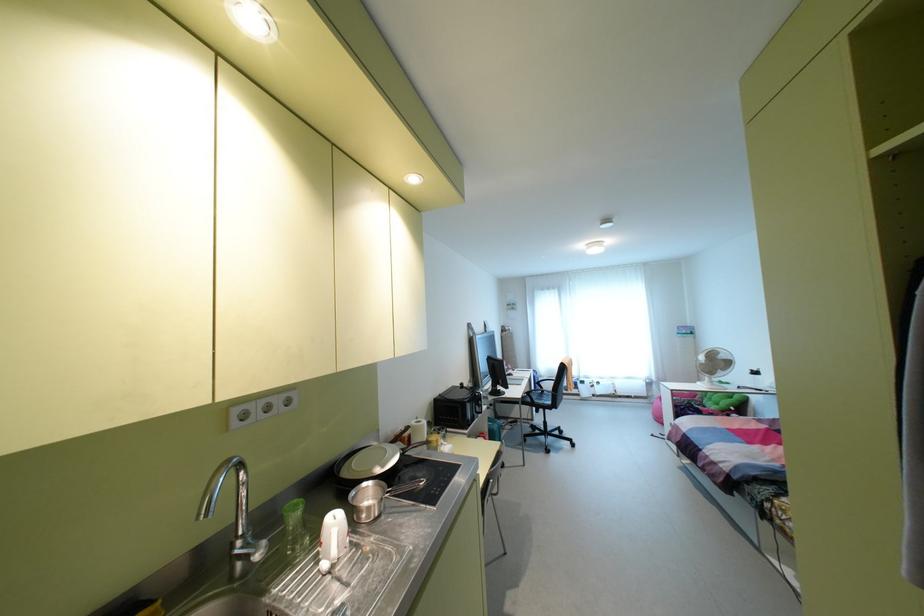
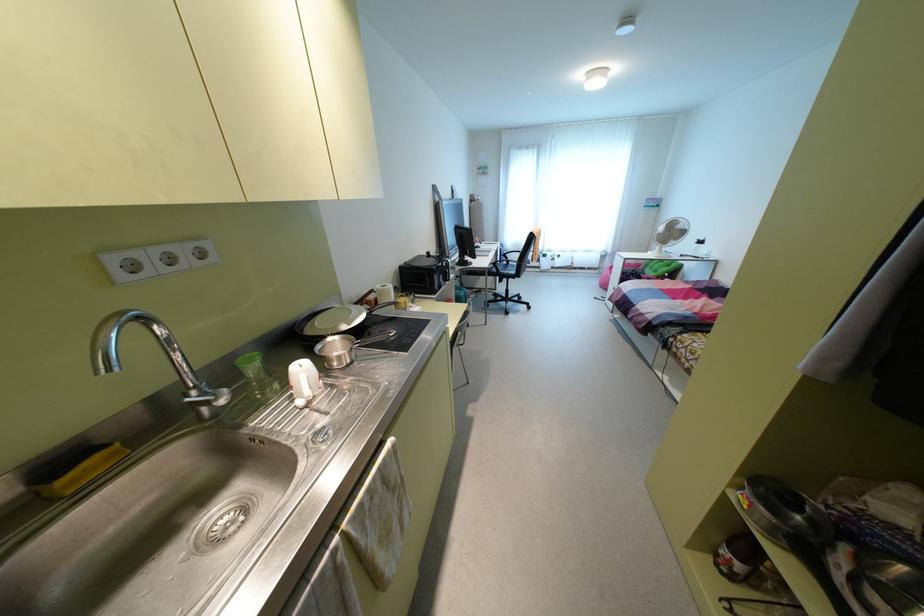
The point at [276,400] is marked in the first image. Where is the corresponding point in the second image?

(181, 251)